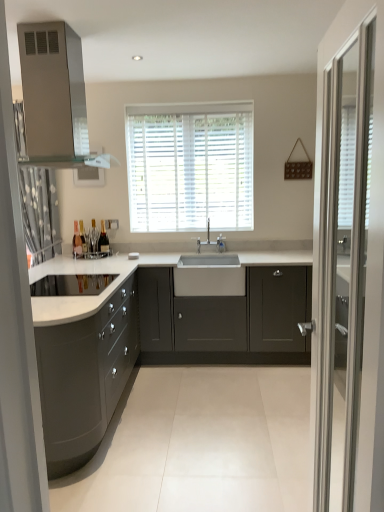
Question: Considering their positions, is matte gray cabinets at left, acting as the second cabinetry starting from the right, located in front of or behind matte gray cabinets at center, the 1th cabinetry positioned from the right?

Choices:
 (A) behind
 (B) front

Answer: (B)

Question: Is point (99, 325) positioned closer to the camera than point (163, 342)?

Choices:
 (A) farther
 (B) closer

Answer: (B)

Question: Which object is the closest to the satin silver vent at upper left?

Choices:
 (A) matte gray cabinets at left, acting as the second cabinetry starting from the right
 (B) matte glass bottle at center, the 2th bottle in the right-to-left sequence
 (C) satin nickel faucet at center
 (D) satin silver sink at center
 (E) matte glass bottle at left, acting as the third bottle starting from the right

Answer: (A)

Question: Estimate the real-world distances between objects in this image. Which object is farther from the white blinds at center?

Choices:
 (A) matte glass bottle at center, arranged as the 2th bottle when viewed from the left
 (B) satin silver sink at center
 (C) matte glass bottle at left, acting as the third bottle starting from the right
 (D) matte glass bottle at left, the third bottle in the left-to-right sequence
 (E) clear glass screen door at right

Answer: (E)